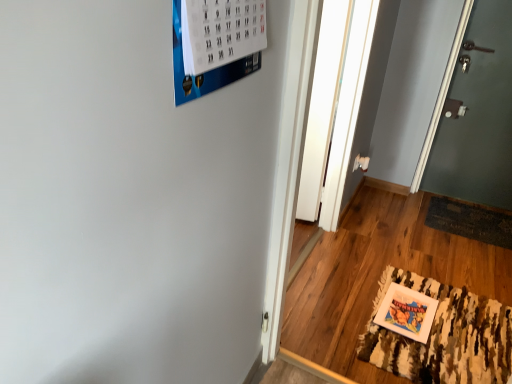
Locate an element on the screen. This screenshot has width=512, height=384. vacant region to the left of dark brown woven mat at lower right is located at coordinates (402, 216).